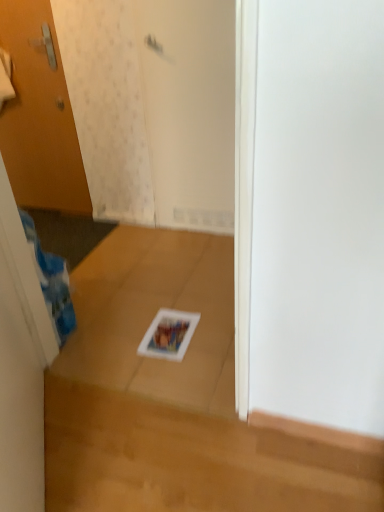
You are a GUI agent. You are given a task and a screenshot of the screen. Output one action in this format:
    pyautogui.click(x=<x>, y=<y>)
    Task: Click on the vacant area to the right of matte white magazine at center
    This screenshot has height=512, width=384.
    Given the screenshot: What is the action you would take?
    pyautogui.click(x=214, y=331)